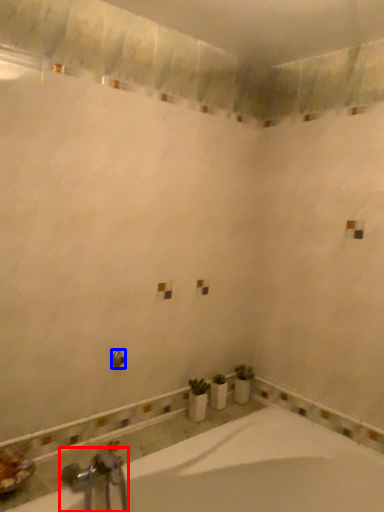
Question: Which object appears farthest to the camera in this image, tap (highlighted by a red box) or shower (highlighted by a blue box)?

Choices:
 (A) tap
 (B) shower

Answer: (B)